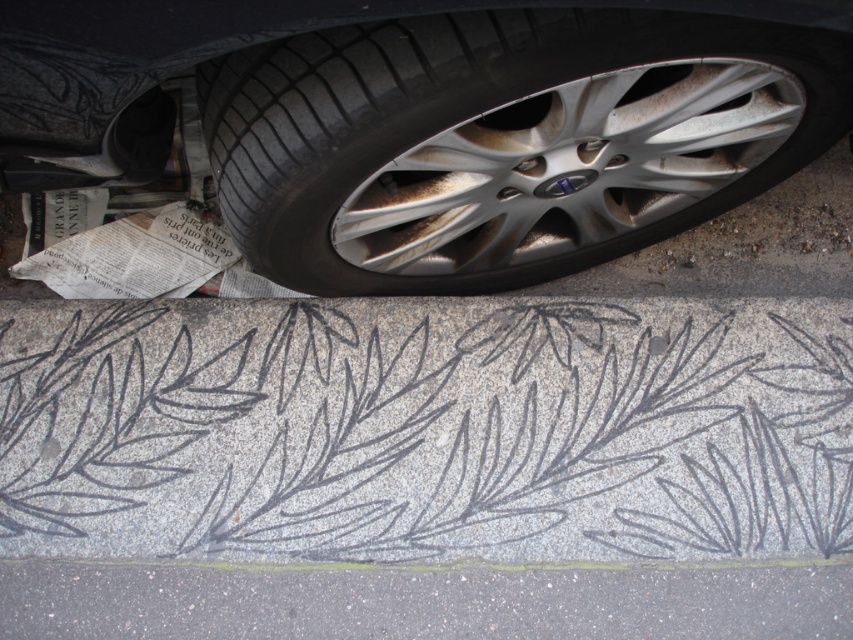
You are a delivery person trying to park your bike between the gray asphalt at lower center and the granite curb at lower center. Which side should you place your bike closer to if you want it to be on the left side of the curb?

The gray asphalt at lower center is positioned on the left side of granite curb at lower center, so you should place your bike closer to the gray asphalt at lower center to have it on the left side of the curb.